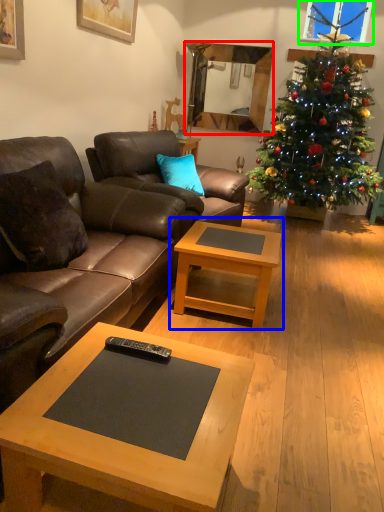
Question: Which object is positioned farthest from mirror (highlighted by a red box)? Select from coffee table (highlighted by a blue box) and window screen (highlighted by a green box).

Choices:
 (A) coffee table
 (B) window screen

Answer: (A)